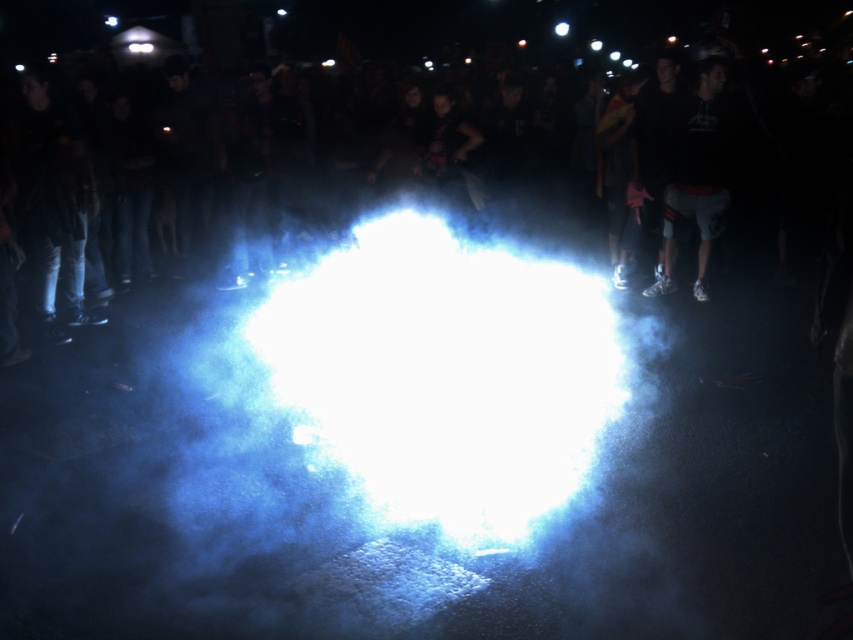
Question: Can you confirm if black matte crowd at center is positioned to the left of dark gray shorts at right?

Choices:
 (A) no
 (B) yes

Answer: (B)

Question: Does black matte crowd at center have a greater width compared to white bright light at center?

Choices:
 (A) no
 (B) yes

Answer: (B)

Question: Which object is closer to the camera taking this photo?

Choices:
 (A) white bright light at center
 (B) dark gray shorts at right
 (C) black matte crowd at center

Answer: (C)

Question: Estimate the real-world distances between objects in this image. Which object is farther from the black matte crowd at center?

Choices:
 (A) white bright light at center
 (B) dark gray shorts at right

Answer: (B)

Question: In this image, where is white bright light at center located relative to dark gray shorts at right?

Choices:
 (A) right
 (B) left

Answer: (B)

Question: Which point is closer to the camera taking this photo?

Choices:
 (A) (579, 317)
 (B) (717, 188)
 (C) (704, 60)

Answer: (A)